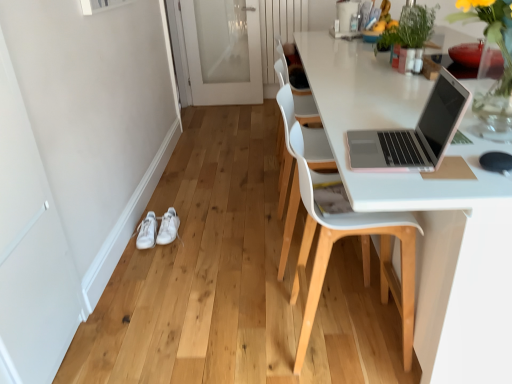
This screenshot has height=384, width=512. What do you see at coordinates (317, 150) in the screenshot? I see `white plastic chair at center, the 1th chair viewed from the back` at bounding box center [317, 150].

This screenshot has height=384, width=512. What are the coordinates of `green leafy plant at upper right` in the screenshot? It's located at (410, 28).

In order to face green leafy plant at upper right, should I rotate leftwards or rightwards?

You should look right and rotate roughly 20.547 degrees.

In order to face pink plastic laptop at upper right, should I rotate leftwards or rightwards?

Turn right approximately 18.487 degrees to face it.

At what (x,y) coordinates should I click in order to perform the action: click on white leather sneakers at lower left, the second footwear in the right-to-left sequence. Please return your answer as a coordinate pair (x, y). Looking at the image, I should click on (147, 232).

This screenshot has width=512, height=384. Identify the location of white plastic chair at center, arranged as the second chair when viewed from the front. (317, 150).

From a real-world perspective, is white leather sneakers at lower left, positioned as the 1th footwear in right-to-left order, physically above white plastic chair at right, which is the 1th chair in front-to-back order?

Actually, white leather sneakers at lower left, positioned as the 1th footwear in right-to-left order, is physically below white plastic chair at right, which is the 1th chair in front-to-back order, in the real world.

Considering the relative sizes of white leather sneakers at lower left, positioned as the 1th footwear in right-to-left order, and white plastic chair at right, which is the 2th chair from back to front, in the image provided, is white leather sneakers at lower left, positioned as the 1th footwear in right-to-left order, smaller than white plastic chair at right, which is the 2th chair from back to front,?

Yes.

What's the angular difference between white leather sneakers at lower left, the second footwear when ordered from left to right, and white plastic chair at right, which is the 2th chair from back to front,'s facing directions?

The angular difference between white leather sneakers at lower left, the second footwear when ordered from left to right, and white plastic chair at right, which is the 2th chair from back to front, is 92.6 degrees.

Is white glossy screen door at lower left, arranged as the 2th screen door when viewed from the top, far away from white leather sneakers at lower left, the second footwear in the right-to-left sequence?

white glossy screen door at lower left, arranged as the 2th screen door when viewed from the top, is actually quite close to white leather sneakers at lower left, the second footwear in the right-to-left sequence.

Could you tell me if white glossy screen door at lower left, placed as the first screen door when sorted from bottom to top, is facing white leather sneakers at lower left, the 1th footwear from the left?

No.

Can you tell me how much white glossy screen door at lower left, which ranks as the 1th screen door in front-to-back order, and white leather sneakers at lower left, the 1th footwear from the left, differ in facing direction?

The angle between the facing direction of white glossy screen door at lower left, which ranks as the 1th screen door in front-to-back order, and the facing direction of white leather sneakers at lower left, the 1th footwear from the left, is 90 degrees.

Is white glossy screen door at lower left, which appears as the 1th screen door when viewed from the left, positioned behind white leather sneakers at lower left, the 1th footwear from the left?

That is False.

From the image's perspective, is white leather sneakers at lower left, positioned as the 1th footwear in right-to-left order, over white plastic chair at center, the 1th chair viewed from the back?

Incorrect, from the image's perspective, white leather sneakers at lower left, positioned as the 1th footwear in right-to-left order, is lower than white plastic chair at center, the 1th chair viewed from the back.

Would you say white leather sneakers at lower left, positioned as the 1th footwear in right-to-left order, is inside or outside white plastic chair at center, the 1th chair viewed from the back?

white leather sneakers at lower left, positioned as the 1th footwear in right-to-left order, is outside white plastic chair at center, the 1th chair viewed from the back.

Can you confirm if white leather sneakers at lower left, the second footwear when ordered from left to right, is wider than white plastic chair at center, arranged as the second chair when viewed from the front?

No, white leather sneakers at lower left, the second footwear when ordered from left to right, is not wider than white plastic chair at center, arranged as the second chair when viewed from the front.

Is white leather sneakers at lower left, the second footwear when ordered from left to right, at the right side of white plastic chair at center, the 1th chair viewed from the back?

No, white leather sneakers at lower left, the second footwear when ordered from left to right, is not to the right of white plastic chair at center, the 1th chair viewed from the back.

How far apart are white glossy screen door at lower left, placed as the first screen door when sorted from bottom to top, and white frosted glass screen door at center, the 1th screen door viewed from the back?

The distance of white glossy screen door at lower left, placed as the first screen door when sorted from bottom to top, from white frosted glass screen door at center, the 1th screen door viewed from the back, is 11.11 feet.

Does white glossy screen door at lower left, arranged as the 2th screen door when viewed from the top, have a larger size compared to white frosted glass screen door at center, the 1th screen door viewed from the back?

No, white glossy screen door at lower left, arranged as the 2th screen door when viewed from the top, is not bigger than white frosted glass screen door at center, the 1th screen door viewed from the back.

Is white glossy screen door at lower left, placed as the first screen door when sorted from bottom to top, to the left or to the right of white frosted glass screen door at center, arranged as the 1th screen door when viewed from the right, in the image?

In the image, white glossy screen door at lower left, placed as the first screen door when sorted from bottom to top, appears on the left side of white frosted glass screen door at center, arranged as the 1th screen door when viewed from the right.

Would you say white glossy screen door at lower left, which ranks as the 1th screen door in front-to-back order, is a long distance from white frosted glass screen door at center, which is the second screen door in bottom-to-top order?

Yes, white glossy screen door at lower left, which ranks as the 1th screen door in front-to-back order, and white frosted glass screen door at center, which is the second screen door in bottom-to-top order, are located far from each other.

Which of these two, green leafy plant at upper right or white leather sneakers at lower left, positioned as the 1th footwear in right-to-left order, is wider?

white leather sneakers at lower left, positioned as the 1th footwear in right-to-left order.

Is green leafy plant at upper right oriented towards white leather sneakers at lower left, positioned as the 1th footwear in right-to-left order?

No, green leafy plant at upper right does not turn towards white leather sneakers at lower left, positioned as the 1th footwear in right-to-left order.

Looking at this image, is the depth of green leafy plant at upper right greater than that of white leather sneakers at lower left, the second footwear when ordered from left to right?

No, green leafy plant at upper right is closer to the viewer.

Based on the photo, are green leafy plant at upper right and white leather sneakers at lower left, positioned as the 1th footwear in right-to-left order, beside each other?

There is a gap between green leafy plant at upper right and white leather sneakers at lower left, positioned as the 1th footwear in right-to-left order.

Locate an element on the screen. Image resolution: width=512 pixels, height=384 pixels. floral arrangement lying behind the pink plastic laptop at upper right is located at coordinates (410, 28).

Consider the image. From a real-world perspective, is green leafy plant at upper right on pink plastic laptop at upper right?

Yes, from a real-world perspective, green leafy plant at upper right is on top of pink plastic laptop at upper right.

Considering the relative sizes of green leafy plant at upper right and pink plastic laptop at upper right in the image provided, is green leafy plant at upper right wider than pink plastic laptop at upper right?

No.

In the scene shown: Visually, is green leafy plant at upper right positioned to the left or to the right of pink plastic laptop at upper right?

In the image, green leafy plant at upper right appears on the right side of pink plastic laptop at upper right.

Which is in front, point (260, 42) or point (408, 40)?

The point (408, 40) is more forward.

From a real-world perspective, who is located higher, white frosted glass screen door at center, arranged as the 1th screen door when viewed from the right, or green leafy plant at upper right?

green leafy plant at upper right.

Identify the location of floral arrangement below the white frosted glass screen door at center, arranged as the 1th screen door when viewed from the right (from the image's perspective). (410, 28).

Considering the relative sizes of white frosted glass screen door at center, the 1th screen door viewed from the back, and green leafy plant at upper right in the image provided, is white frosted glass screen door at center, the 1th screen door viewed from the back, smaller than green leafy plant at upper right?

Actually, white frosted glass screen door at center, the 1th screen door viewed from the back, might be larger than green leafy plant at upper right.

There is a white plastic chair at right, which is the 2th chair from back to front. Where is `the 1st footwear below it (from a real-world perspective)`? This screenshot has width=512, height=384. the 1st footwear below it (from a real-world perspective) is located at coordinates (168, 227).

From a real-world perspective, count 2nd screen doors upward from the white leather sneakers at lower left, the 1th footwear from the left, and point to it. Please provide its 2D coordinates.

[(31, 251)]

From the image, which object appears to be nearer to white plastic chair at right, which is the 2th chair from back to front, green leafy plant at upper right or white frosted glass screen door at center, which is the second screen door in bottom-to-top order?

The object closer to white plastic chair at right, which is the 2th chair from back to front, is green leafy plant at upper right.

Considering their positions, is white glossy screen door at lower left, arranged as the 2th screen door when viewed from the top, positioned further to white plastic chair at right, which is the 2th chair from back to front, than pink plastic laptop at upper right?

white glossy screen door at lower left, arranged as the 2th screen door when viewed from the top, lies further to white plastic chair at right, which is the 2th chair from back to front, than the other object.

Based on their spatial positions, is white leather sneakers at lower left, the 1th footwear from the left, or white leather sneakers at lower left, positioned as the 1th footwear in right-to-left order, closer to white frosted glass screen door at center, positioned as the second screen door in left-to-right order?

white leather sneakers at lower left, positioned as the 1th footwear in right-to-left order, is positioned closer to the anchor white frosted glass screen door at center, positioned as the second screen door in left-to-right order.

Estimate the real-world distances between objects in this image. Which object is further from white plastic chair at center, arranged as the second chair when viewed from the front, white leather sneakers at lower left, the 1th footwear from the left, or white plastic chair at right, which is the 2th chair from back to front?

white leather sneakers at lower left, the 1th footwear from the left, lies further to white plastic chair at center, arranged as the second chair when viewed from the front, than the other object.

When comparing their distances from white frosted glass screen door at center, the 1th screen door positioned from the top, does white plastic chair at center, the 1th chair viewed from the back, or pink plastic laptop at upper right seem further?

Based on the image, pink plastic laptop at upper right appears to be further to white frosted glass screen door at center, the 1th screen door positioned from the top.

When comparing their distances from white plastic chair at right, which is the 2th chair from back to front, does white glossy screen door at lower left, arranged as the 2th screen door when viewed from the top, or white leather sneakers at lower left, the second footwear when ordered from left to right, seem further?

The object further to white plastic chair at right, which is the 2th chair from back to front, is white leather sneakers at lower left, the second footwear when ordered from left to right.

Considering their positions, is white frosted glass screen door at center, which is the second screen door in bottom-to-top order, positioned further to white leather sneakers at lower left, positioned as the 1th footwear in right-to-left order, than white plastic chair at center, the 1th chair viewed from the back?

white frosted glass screen door at center, which is the second screen door in bottom-to-top order, is positioned further to the anchor white leather sneakers at lower left, positioned as the 1th footwear in right-to-left order.

In the scene shown: From the image, which object appears to be farther from white leather sneakers at lower left, the second footwear in the right-to-left sequence, green leafy plant at upper right or pink plastic laptop at upper right?

Based on the image, green leafy plant at upper right appears to be further to white leather sneakers at lower left, the second footwear in the right-to-left sequence.

This screenshot has width=512, height=384. What are the coordinates of `footwear between white leather sneakers at lower left, the second footwear in the right-to-left sequence, and green leafy plant at upper right, in the horizontal direction` in the screenshot? It's located at (168, 227).

What are the coordinates of `laptop situated between white leather sneakers at lower left, the second footwear in the right-to-left sequence, and green leafy plant at upper right from left to right` in the screenshot? It's located at (413, 134).

Find the location of a particular element. chair between green leafy plant at upper right and white plastic chair at right, which is the 2th chair from back to front, vertically is located at coordinates (317, 150).

The image size is (512, 384). What are the coordinates of `footwear between white glossy screen door at lower left, placed as the first screen door when sorted from bottom to top, and white leather sneakers at lower left, the second footwear when ordered from left to right, in the front-back direction` in the screenshot? It's located at (147, 232).